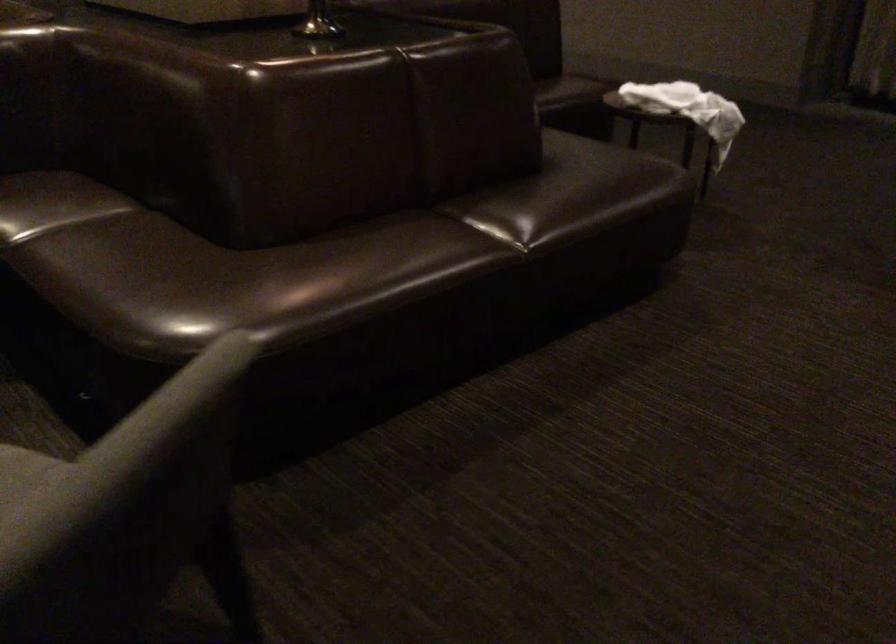
Where is `brown sofa sitting surface`? The height and width of the screenshot is (644, 896). brown sofa sitting surface is located at coordinates (229, 269).